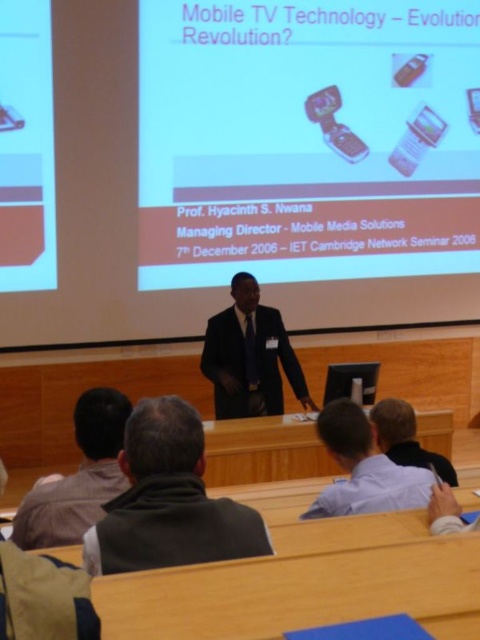
You are an attendee at this presentation. You want to take a photo of the presenter but need to ensure you can see both the presenter and the slide on the screen. The presenter is standing at the podium. Is the light brown fabric jacket at lower left blocking your view of the matte black screen at left?

The light brown fabric jacket at lower left is behind the matte black screen at left, so it is not blocking the view of the screen. You can take the photo without any obstruction.

You are organizing a photo shoot and need to ensure that the striped shirt at lower left and the light blue shirt at center are visible in the final image. Given that the camera has a fixed focus on the presenter, which shirt might appear larger in the photo?

The striped shirt at lower left appears larger because its width is greater than the light blue shirt at center.